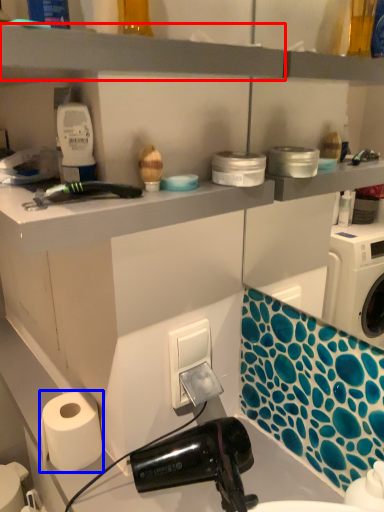
Question: Among these objects, which one is farthest to the camera, shelf (highlighted by a red box) or paper towel (highlighted by a blue box)?

Choices:
 (A) shelf
 (B) paper towel

Answer: (B)